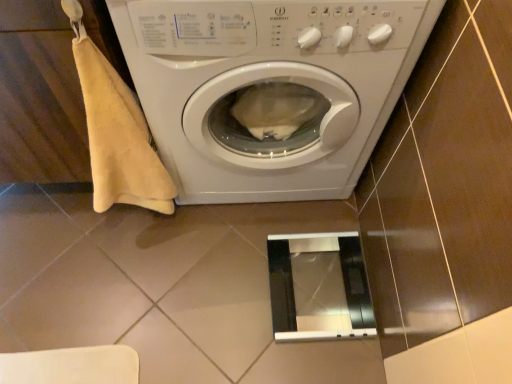
Question: Could you tell me if white glossy washing machine at center is facing metallic silver screen door at lower center?

Choices:
 (A) no
 (B) yes

Answer: (B)

Question: Can you confirm if white glossy washing machine at center is thinner than metallic silver screen door at lower center?

Choices:
 (A) no
 (B) yes

Answer: (A)

Question: From a real-world perspective, is white glossy washing machine at center beneath metallic silver screen door at lower center?

Choices:
 (A) yes
 (B) no

Answer: (B)

Question: Would you say metallic silver screen door at lower center is part of white glossy washing machine at center's contents?

Choices:
 (A) yes
 (B) no

Answer: (B)

Question: Is white glossy washing machine at center behind metallic silver screen door at lower center?

Choices:
 (A) no
 (B) yes

Answer: (A)

Question: Would you say metallic silver screen door at lower center is inside or outside beige cotton towel at left?

Choices:
 (A) inside
 (B) outside

Answer: (B)

Question: Is metallic silver screen door at lower center in front of or behind beige cotton towel at left in the image?

Choices:
 (A) behind
 (B) front

Answer: (A)

Question: In terms of width, does metallic silver screen door at lower center look wider or thinner when compared to beige cotton towel at left?

Choices:
 (A) wide
 (B) thin

Answer: (A)

Question: Is metallic silver screen door at lower center to the left or to the right of beige cotton towel at left in the image?

Choices:
 (A) left
 (B) right

Answer: (B)

Question: From the image's perspective, is metallic silver screen door at lower center positioned above or below white glossy washing machine at center?

Choices:
 (A) below
 (B) above

Answer: (A)

Question: Visually, is metallic silver screen door at lower center positioned to the left or to the right of white glossy washing machine at center?

Choices:
 (A) right
 (B) left

Answer: (A)

Question: Considering the positions of metallic silver screen door at lower center and white glossy washing machine at center in the image, is metallic silver screen door at lower center wider or thinner than white glossy washing machine at center?

Choices:
 (A) thin
 (B) wide

Answer: (A)

Question: From a real-world perspective, is metallic silver screen door at lower center positioned above or below white glossy washing machine at center?

Choices:
 (A) above
 (B) below

Answer: (B)

Question: Is white glossy washing machine at center in front of or behind beige cotton towel at left in the image?

Choices:
 (A) behind
 (B) front

Answer: (A)

Question: In terms of size, does white glossy washing machine at center appear bigger or smaller than beige cotton towel at left?

Choices:
 (A) small
 (B) big

Answer: (B)